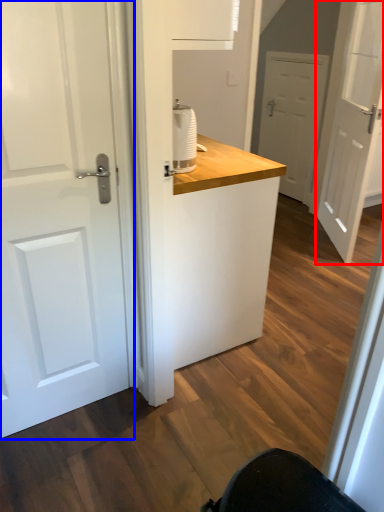
Question: Among these objects, which one is nearest to the camera, door (highlighted by a red box) or door (highlighted by a blue box)?

Choices:
 (A) door
 (B) door

Answer: (B)